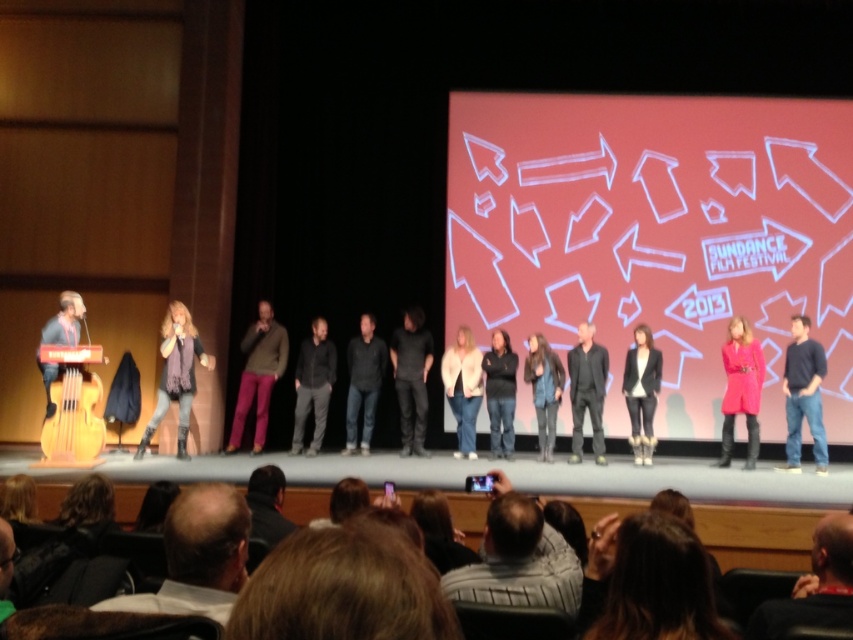
Question: Estimate the real-world distances between objects in this image. Which object is closer to the gray striped sweater at lower center?

Choices:
 (A) dark brown leather jacket at lower right
 (B) dark gray/black fabric at center
 (C) black matte shirt at center

Answer: (A)

Question: Is dark blue sweater at right positioned at the back of black leather jacket at lower center?

Choices:
 (A) yes
 (B) no

Answer: (A)

Question: Which object appears closest to the camera in this image?

Choices:
 (A) black matte shirt at center
 (B) dark gray jeans at center

Answer: (A)

Question: Is dark gray/black fabric at center wider than dark gray sweater at center?

Choices:
 (A) yes
 (B) no

Answer: (A)

Question: In this image, where is brown hair at lower center located relative to denim jacket at center?

Choices:
 (A) below
 (B) above

Answer: (B)

Question: Which point is closer to the camera?

Choices:
 (A) black matte shirt at center
 (B) wooden acoustic guitar at left
 (C) black leather jacket at lower center
 (D) brown hair at lower center

Answer: (D)